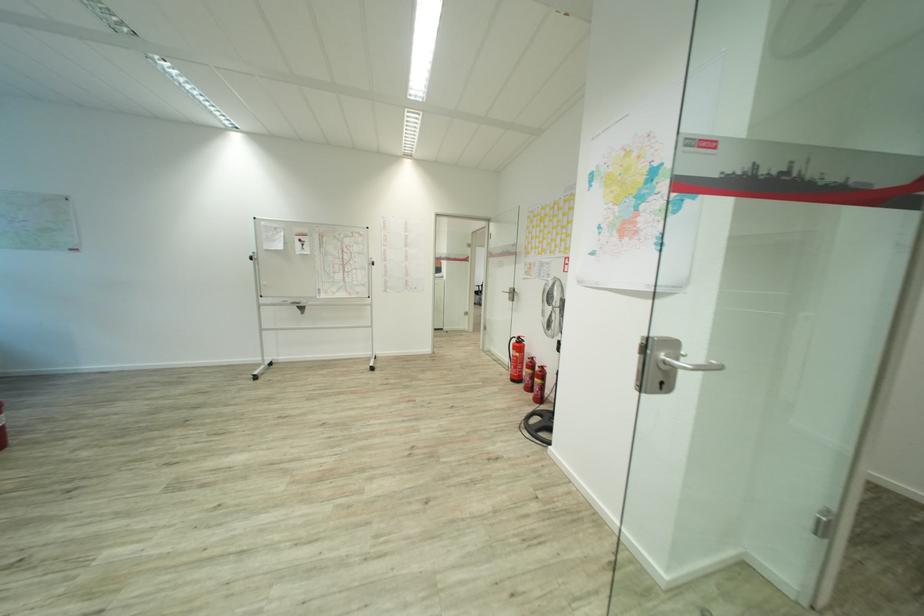
Find where to turn the silver door handle. Please return your answer as a coordinate pair (x, y).

(689, 365)